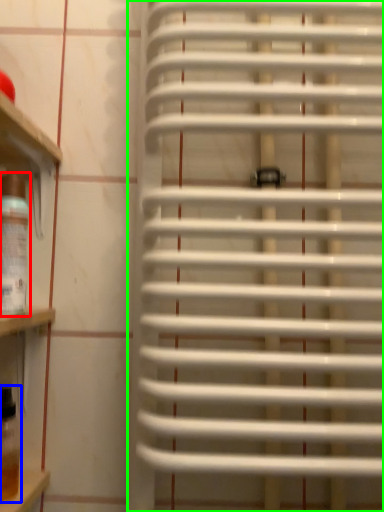
Question: Based on their relative distances, which object is nearer to wine bottle (highlighted by a red box)? Choose from wine bottle (highlighted by a blue box) and window blind (highlighted by a green box).

Choices:
 (A) wine bottle
 (B) window blind

Answer: (A)